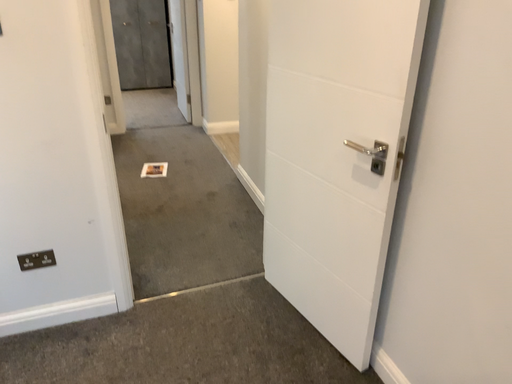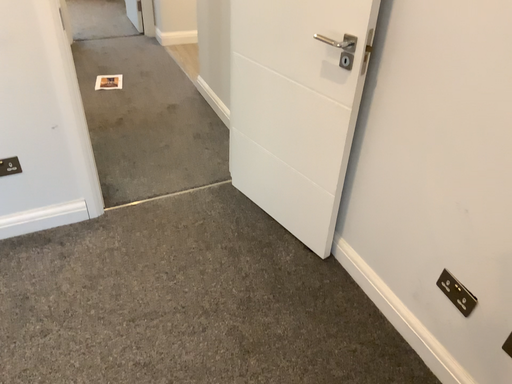
Question: How did the camera likely rotate when shooting the video?

Choices:
 (A) rotated downward
 (B) rotated upward

Answer: (A)